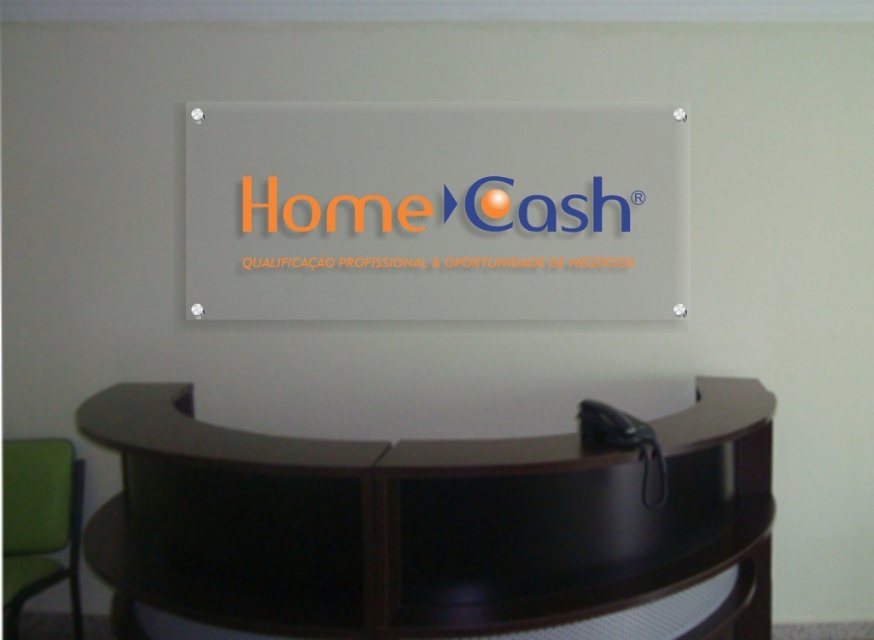
You are a visitor entering the reception area and want to sit down. You see the transparent acrylic sign at center and the green fabric chair at lower left. Which object is closer to you as you enter?

The transparent acrylic sign at center is closer to you because it is further to the viewer than the green fabric chair at lower left, meaning it is positioned nearer in your line of sight.

You are a visitor who just entered the reception area and want to sit down. You see the transparent acrylic sign at center and the green fabric chair at lower left. Which object is closer to you?

The green fabric chair at lower left is closer to you because it is only 4.00 feet away from the transparent acrylic sign at center, and you are standing near the entrance which is likely near the chair.